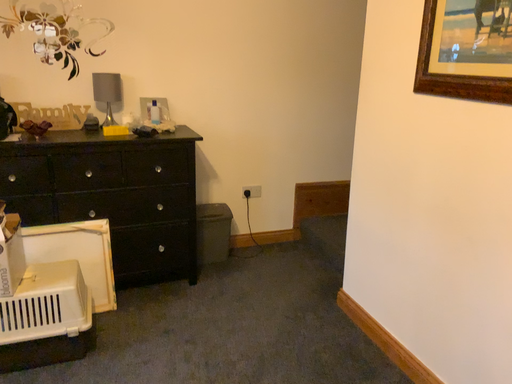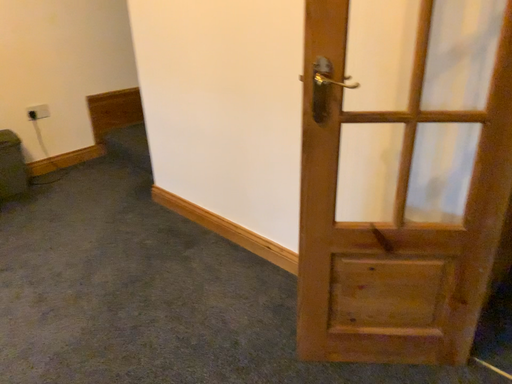
Question: Which way did the camera rotate in the video?

Choices:
 (A) rotated left
 (B) rotated right

Answer: (B)